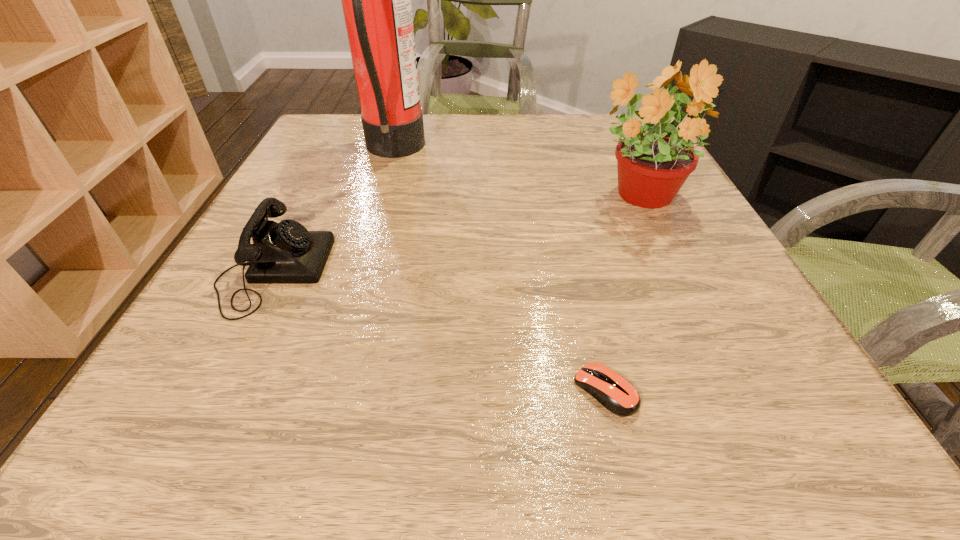
Locate an element on the screen. This screenshot has width=960, height=540. vacant region located on the back of the nearest object is located at coordinates (562, 209).

The height and width of the screenshot is (540, 960). Find the location of `object at the far edge`. object at the far edge is located at coordinates [376, 0].

Locate an element on the screen. object that is at the near edge is located at coordinates (618, 395).

You are a GUI agent. You are given a task and a screenshot of the screen. Output one action in this format:
    pyautogui.click(x=<x>, y=<y>)
    Task: Click on the fire extinguisher at the left edge
    Image resolution: width=960 pixels, height=540 pixels.
    Given the screenshot: What is the action you would take?
    pyautogui.click(x=376, y=0)

Locate an element on the screen. Image resolution: width=960 pixels, height=540 pixels. telephone at the left edge is located at coordinates point(286,252).

Where is `object located in the right edge section of the desktop`? The width and height of the screenshot is (960, 540). object located in the right edge section of the desktop is located at coordinates (652, 167).

You are a GUI agent. You are given a task and a screenshot of the screen. Output one action in this format:
    pyautogui.click(x=<x>, y=<y>)
    Task: Click on the object at the far left corner
    Image resolution: width=960 pixels, height=540 pixels.
    Given the screenshot: What is the action you would take?
    pyautogui.click(x=376, y=0)

Image resolution: width=960 pixels, height=540 pixels. What are the coordinates of `blank space at the far edge` in the screenshot? It's located at (474, 122).

In the image, there is a desktop. In order to click on vacant area at the near edge in this screenshot , I will do `click(350, 445)`.

Identify the location of free location at the left edge of the desktop. The image size is (960, 540). (348, 197).